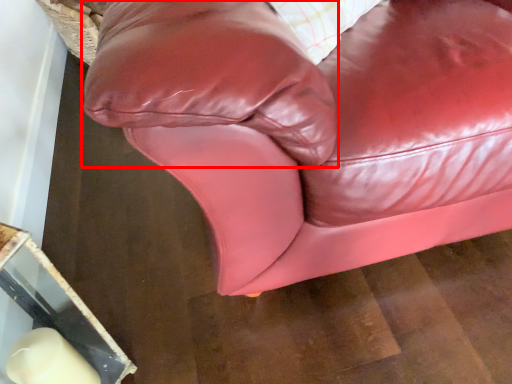
Question: From the image, what is the correct spatial relationship of pillow (annotated by the red box) in relation to studio couch?

Choices:
 (A) left
 (B) right

Answer: (B)